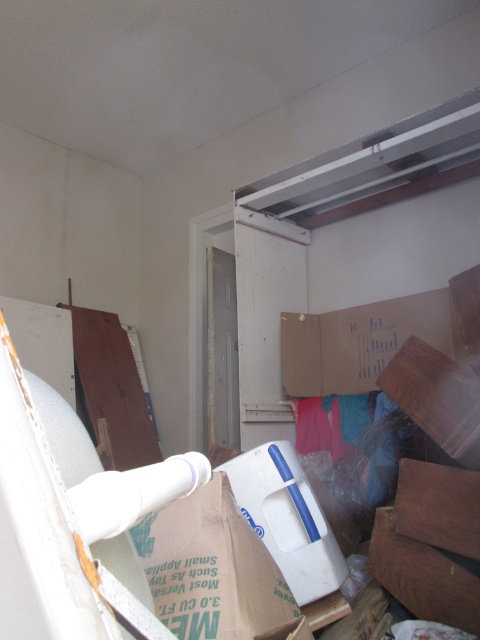
Question: Is the position of cardboard box at center less distant than that of white plastic box at center?

Choices:
 (A) yes
 (B) no

Answer: (A)

Question: Which of the following is the closest to the observer?

Choices:
 (A) cardboard box at center
 (B) white plastic box at center

Answer: (A)

Question: In this image, where is cardboard box at center located relative to white plastic box at center?

Choices:
 (A) above
 (B) below

Answer: (A)

Question: Which of these objects is positioned closest to the white plastic box at center?

Choices:
 (A) cardboard box at center
 (B) cardboard at upper center

Answer: (A)

Question: Is cardboard at upper center closer to the viewer compared to white plastic box at center?

Choices:
 (A) yes
 (B) no

Answer: (B)

Question: Which object appears farthest from the camera in this image?

Choices:
 (A) white plastic box at center
 (B) cardboard box at center
 (C) cardboard at upper center

Answer: (C)